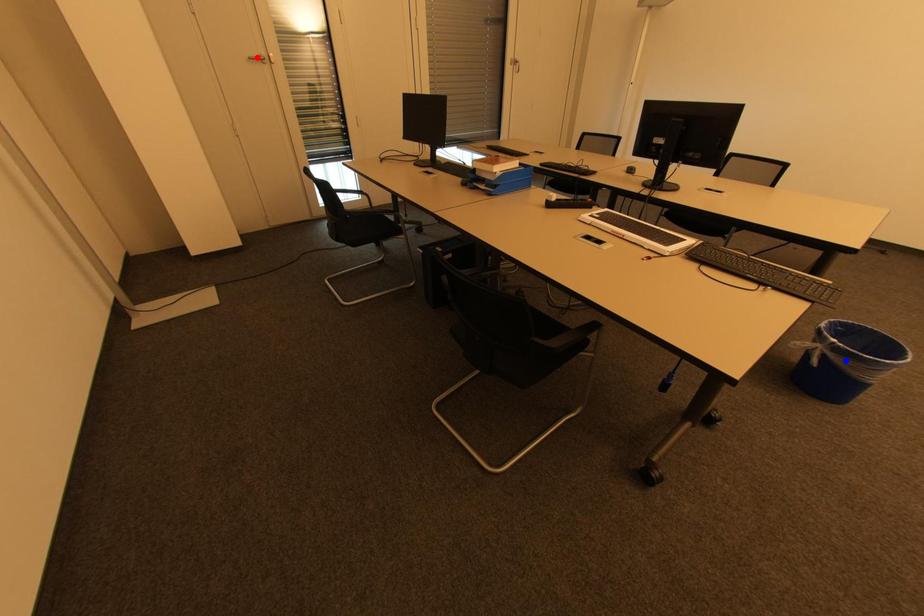
Question: Which of the two points in the image is closer to the camera?

Choices:
 (A) Blue point is closer.
 (B) Red point is closer.

Answer: (A)